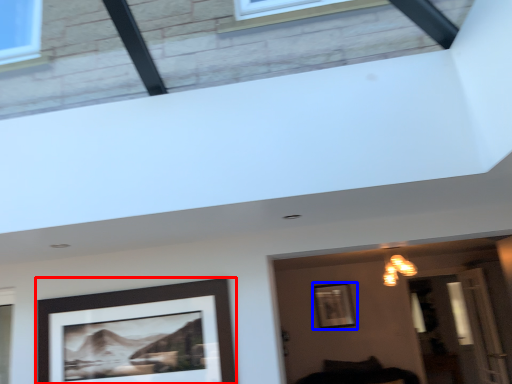
Question: Which point is closer to the camera, picture frame (highlighted by a red box) or picture frame (highlighted by a blue box)?

Choices:
 (A) picture frame
 (B) picture frame

Answer: (A)